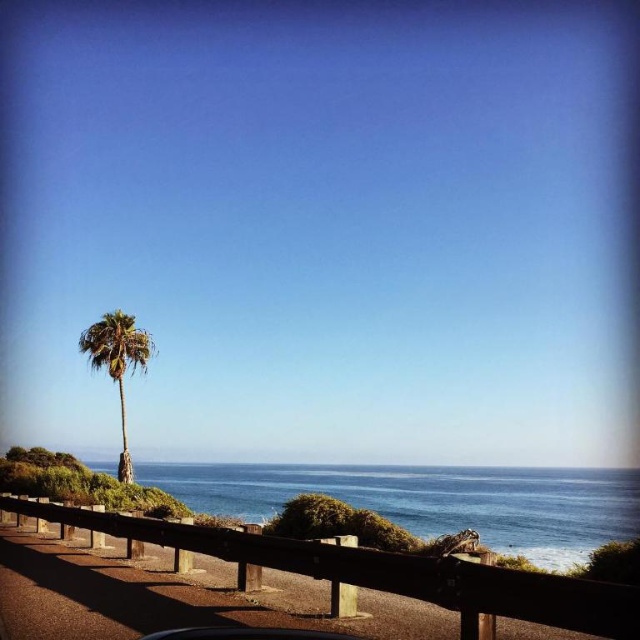
Is blue water at center below green leafy palm tree at left?

Correct, blue water at center is located below green leafy palm tree at left.

Between blue water at center and green leafy palm tree at left, which one is positioned higher?

green leafy palm tree at left is above.

Where is `blue water at center`? This screenshot has width=640, height=640. blue water at center is located at coordinates (432, 499).

This screenshot has width=640, height=640. What are the coordinates of `blue water at center` in the screenshot? It's located at (432, 499).

Who is taller, blue water at center or brown wooden railing at lower center?

With more height is blue water at center.

Does blue water at center have a greater width compared to brown wooden railing at lower center?

Yes, blue water at center is wider than brown wooden railing at lower center.

Between point (547, 481) and point (499, 576), which one is positioned behind?

The point (547, 481) is behind.

The height and width of the screenshot is (640, 640). Identify the location of blue water at center. (432, 499).

Between brown wooden railing at lower center and green leafy palm tree at left, which one appears on the left side from the viewer's perspective?

From the viewer's perspective, green leafy palm tree at left appears more on the left side.

Is brown wooden railing at lower center smaller than green leafy palm tree at left?

Incorrect, brown wooden railing at lower center is not smaller in size than green leafy palm tree at left.

Is point (432, 556) closer to viewer compared to point (102, 337)?

Yes, point (432, 556) is closer to viewer.

The height and width of the screenshot is (640, 640). I want to click on brown wooden railing at lower center, so click(384, 570).